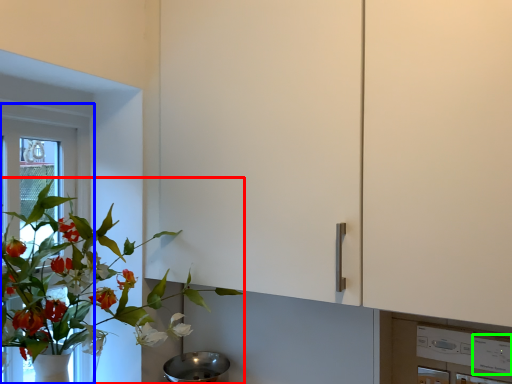
Question: Which is farther away from houseplant (highlighted by a red box)? window frame (highlighted by a blue box) or appliance (highlighted by a green box)?

Choices:
 (A) window frame
 (B) appliance

Answer: (B)